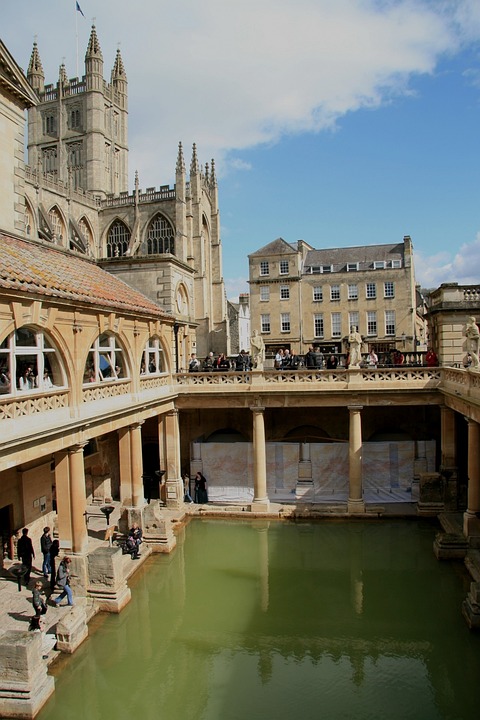
At what (x,y) coordinates should I click in order to perform the action: click on window. Please return your answer as a coordinate pair (x, y). Looking at the image, I should click on (372, 288).